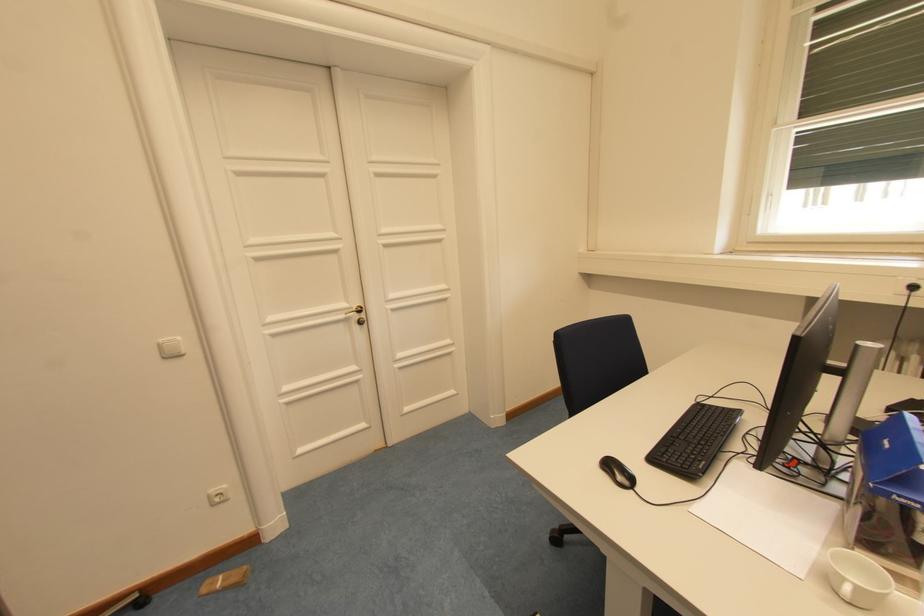
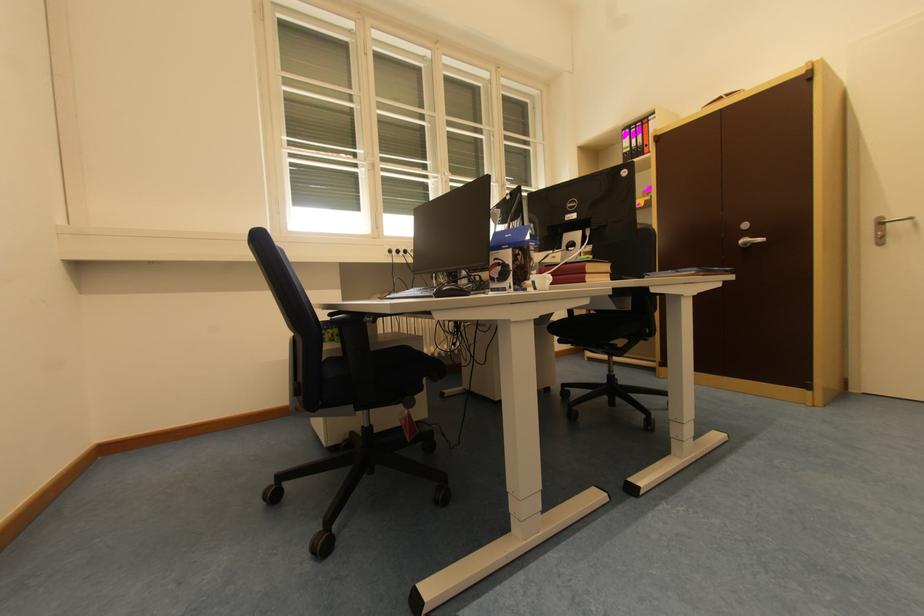
In the second image, find the point that corresponds to [893,444] in the first image.

(514, 238)